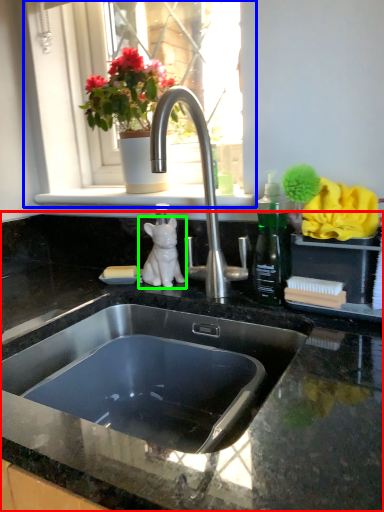
Question: Which object is positioned closest to countertop (highlighted by a red box)? Select from window (highlighted by a blue box) and animal (highlighted by a green box).

Choices:
 (A) window
 (B) animal

Answer: (B)